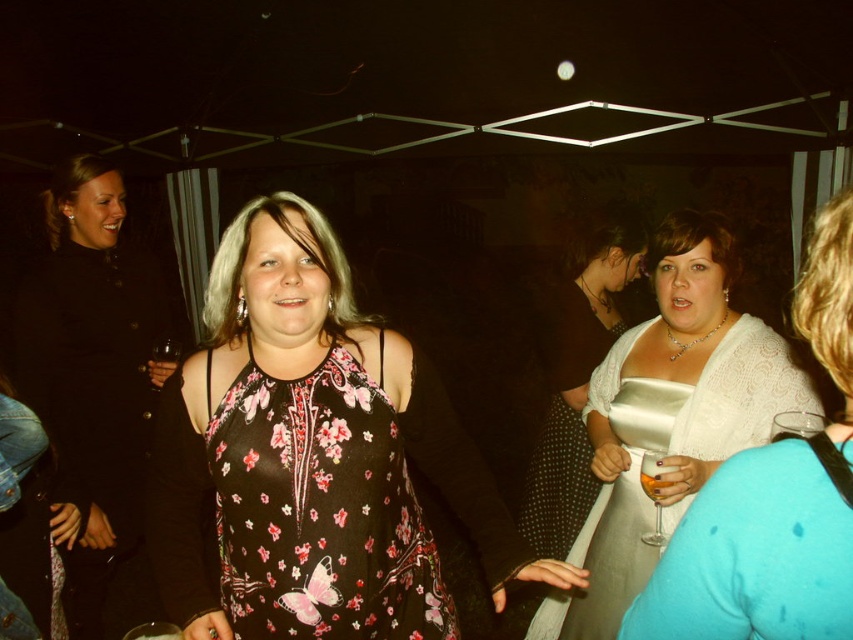
You are standing at the position of point (595, 316) and want to move towards the entrance of the tent. There is an obstacle at point (424, 557). Can you walk directly towards the entrance without going around the obstacle?

Point (424, 557) is in front of point (595, 316), so you cannot walk directly towards the entrance without going around the obstacle at point (424, 557).